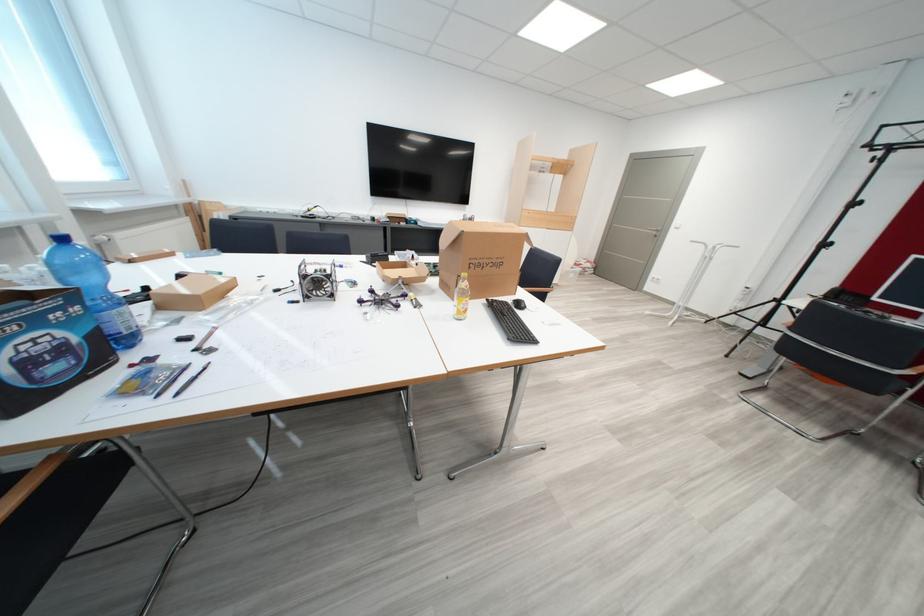
The location [382,299] corresponds to which object?

This point indicates the small drone.